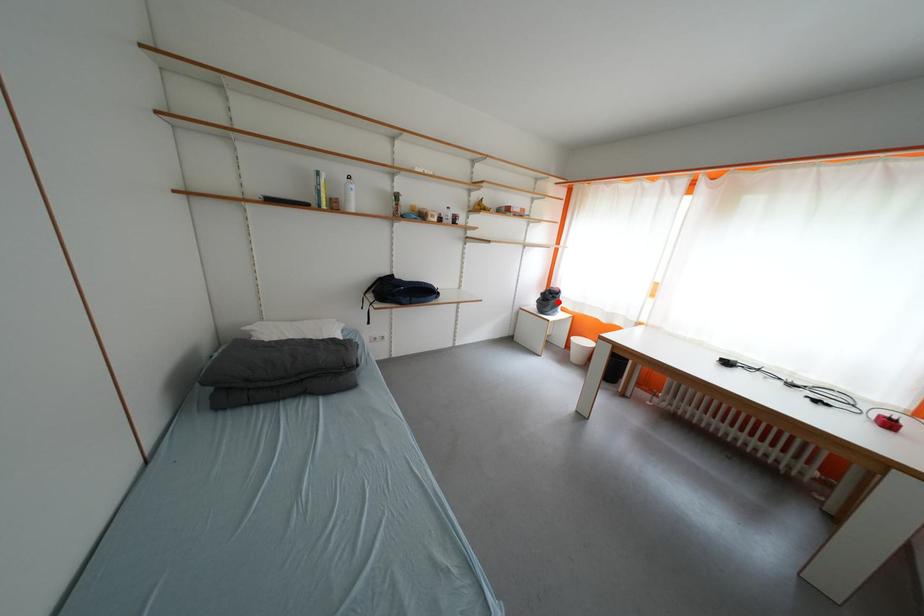
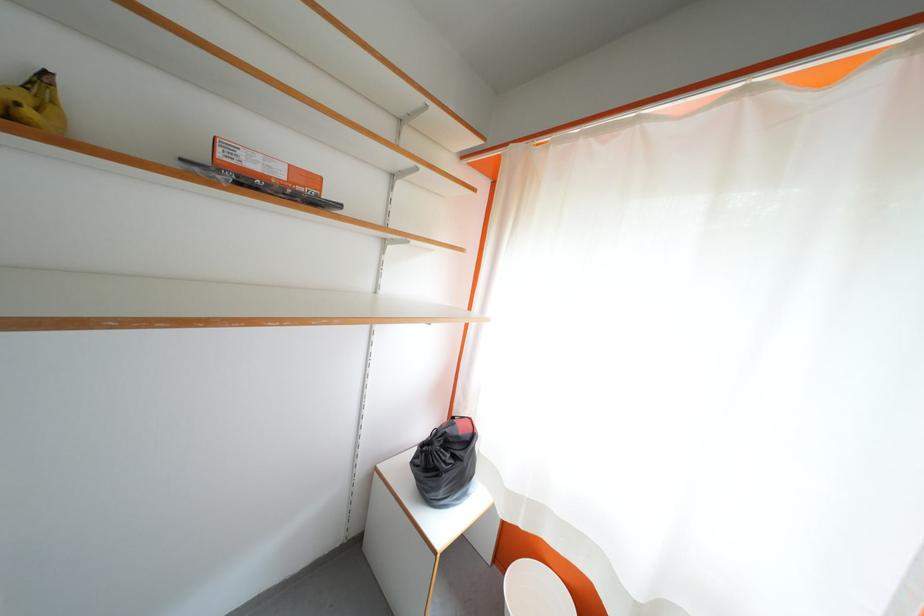
Question: A red point is marked in image1. In image2, is the corresponding 3D point closer to the camera or farther? Reply with the corresponding letter.

Choices:
 (A) The corresponding 3D point is closer.
 (B) The corresponding 3D point is farther.

Answer: (B)